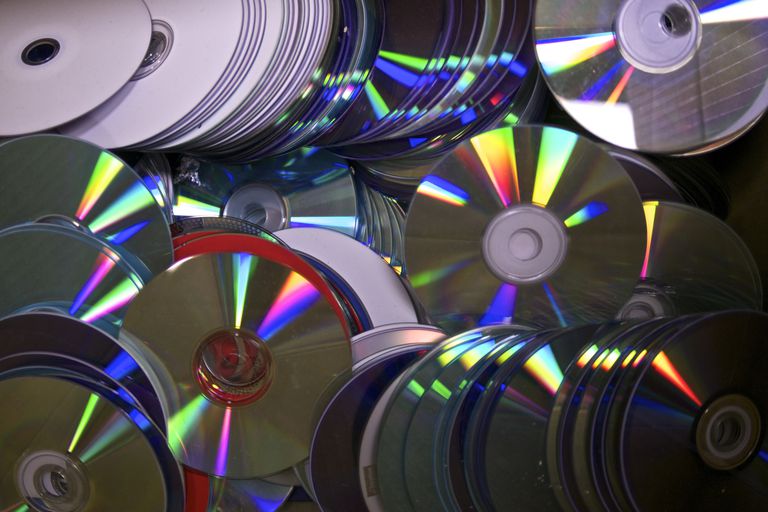
Where is `cd`? cd is located at coordinates (48, 419).